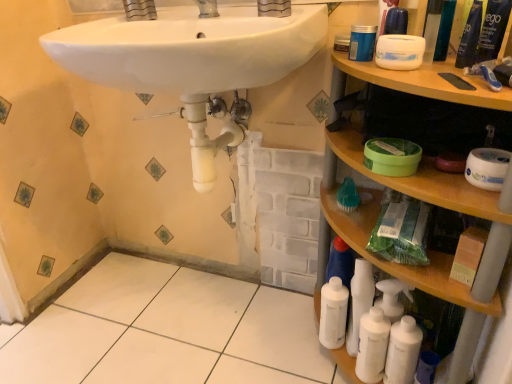
This screenshot has width=512, height=384. Find the location of `matte silver faucet at upper center`. matte silver faucet at upper center is located at coordinates (274, 8).

Describe the element at coordinates (403, 351) in the screenshot. The image size is (512, 384). I see `white glossy mouthwash at lower right, the fourth mouthwash when ordered from right to left` at that location.

The width and height of the screenshot is (512, 384). In order to click on blue plastic container at upper right, the 2th mouthwash positioned from the bottom in this screenshot , I will do pyautogui.click(x=362, y=43).

Describe the element at coordinates (362, 43) in the screenshot. I see `blue plastic container at upper right, the 2th mouthwash positioned from the bottom` at that location.

I want to click on matte silver faucet at upper center, so click(274, 8).

Does white matte toilet paper at right, which appears as the 1th toilet paper when viewed from the right, turn towards white tile floor at lower left?

No, white matte toilet paper at right, which appears as the 1th toilet paper when viewed from the right, does not turn towards white tile floor at lower left.

From a real-world perspective, does white matte toilet paper at right, marked as the 2th toilet paper in a left-to-right arrangement, stand above white tile floor at lower left?

Yes, from a real-world perspective, white matte toilet paper at right, marked as the 2th toilet paper in a left-to-right arrangement, is on top of white tile floor at lower left.

Consider the image. Considering the relative positions of white matte toilet paper at right, which appears as the 1th toilet paper when viewed from the right, and white tile floor at lower left in the image provided, is white matte toilet paper at right, which appears as the 1th toilet paper when viewed from the right, in front of white tile floor at lower left?

Yes, white matte toilet paper at right, which appears as the 1th toilet paper when viewed from the right, is in front of white tile floor at lower left.

Is blue glossy mouthwash at upper right, marked as the 1th mouthwash in a right-to-left arrangement, outside of white matte toothpaste at upper right?

blue glossy mouthwash at upper right, marked as the 1th mouthwash in a right-to-left arrangement, lies outside white matte toothpaste at upper right's area.

Are blue glossy mouthwash at upper right, which is counted as the third mouthwash, starting from the bottom, and white matte toothpaste at upper right beside each other?

blue glossy mouthwash at upper right, which is counted as the third mouthwash, starting from the bottom, and white matte toothpaste at upper right are not in contact.

Can you tell me how much blue glossy mouthwash at upper right, the 3th mouthwash viewed from the top, and white matte toothpaste at upper right differ in facing direction?

38.2 degrees.

Which of these two, blue glossy mouthwash at upper right, which is counted as the third mouthwash, starting from the bottom, or white matte toothpaste at upper right, stands taller?

With more height is blue glossy mouthwash at upper right, which is counted as the third mouthwash, starting from the bottom.

What's the angular difference between white matte toothpaste at upper right and white glossy sink at upper center's facing directions?

The angle between the facing direction of white matte toothpaste at upper right and the facing direction of white glossy sink at upper center is 91.6 degrees.

From a real-world perspective, does white matte toothpaste at upper right stand above white glossy sink at upper center?

Incorrect, from a real-world perspective, white matte toothpaste at upper right is lower than white glossy sink at upper center.

Which of these two, white matte toothpaste at upper right or white glossy sink at upper center, is smaller?

white matte toothpaste at upper right.

Would you say white matte toothpaste at upper right is inside or outside white glossy sink at upper center?

white matte toothpaste at upper right is not inside white glossy sink at upper center, it's outside.

From the image's perspective, which is below, blue plastic container at upper right, which ranks as the 5th mouthwash in right-to-left order, or blue glossy tube at upper right, which is counted as the 2th cleaning product, starting from the bottom?

From the image's view, blue glossy tube at upper right, which is counted as the 2th cleaning product, starting from the bottom, is below.

Which is behind, blue plastic container at upper right, the 2th mouthwash positioned from the bottom, or blue glossy tube at upper right, which is counted as the 2th cleaning product, starting from the back?

blue plastic container at upper right, the 2th mouthwash positioned from the bottom, is behind.

Which of these two, blue plastic container at upper right, which appears as the 4th mouthwash when viewed from the top, or blue glossy tube at upper right, marked as the 1th cleaning product in a top-to-bottom arrangement, is wider?

blue plastic container at upper right, which appears as the 4th mouthwash when viewed from the top, is wider.

Can you tell me how much blue plastic mouthwash at upper right, which ranks as the third mouthwash in left-to-right order, and white glossy sink at upper center differ in facing direction?

blue plastic mouthwash at upper right, which ranks as the third mouthwash in left-to-right order, and white glossy sink at upper center are facing 0.553 degrees away from each other.

Which is in front, blue plastic mouthwash at upper right, which appears as the fourth mouthwash when ordered from the bottom, or white glossy sink at upper center?

white glossy sink at upper center is in front.

Measure the distance from blue plastic mouthwash at upper right, which is the 2th mouthwash in top-to-bottom order, to white glossy sink at upper center.

blue plastic mouthwash at upper right, which is the 2th mouthwash in top-to-bottom order, and white glossy sink at upper center are 17.54 inches apart from each other.

This screenshot has height=384, width=512. There is a white glossy sink at upper center. What are the coordinates of `the 3rd mouthwash above it (from the image's perspective)` in the screenshot? It's located at (432, 28).

Which object is wider, white glossy mouthwash at lower right, positioned as the first mouthwash in bottom-to-top order, or blue glossy tube at upper right, which is counted as the 2th cleaning product, starting from the bottom?

white glossy mouthwash at lower right, positioned as the first mouthwash in bottom-to-top order, is wider.

Considering the positions of points (410, 320) and (472, 43), is point (410, 320) closer to camera compared to point (472, 43)?

No, it is not.

Is white glossy mouthwash at lower right, positioned as the first mouthwash in bottom-to-top order, located outside blue glossy tube at upper right, the first cleaning product viewed from the right?

That's correct, white glossy mouthwash at lower right, positioned as the first mouthwash in bottom-to-top order, is outside of blue glossy tube at upper right, the first cleaning product viewed from the right.

From the image's perspective, is white glossy tap at upper center under blue glossy tube at upper right, the 2th cleaning product positioned from the left?

No.

Between point (211, 4) and point (477, 15), which one is positioned behind?

The point (211, 4) is more distant.

Is white glossy tap at upper center taller than blue glossy tube at upper right, which is the first cleaning product from front to back?

No.

In the scene shown: Considering the sizes of objects white glossy tap at upper center and blue glossy tube at upper right, which is counted as the 2th cleaning product, starting from the bottom, in the image provided, who is bigger, white glossy tap at upper center or blue glossy tube at upper right, which is counted as the 2th cleaning product, starting from the bottom,?

white glossy tap at upper center.

Find the location of a particular element. Image resolution: width=512 pixels, height=384 pixels. the 2nd toilet paper counting from the right of the white tile floor at lower left is located at coordinates (487, 168).

This screenshot has height=384, width=512. Find the location of `the 3rd mouthwash positioned above the white matte toothpaste at upper right (from a real-world perspective)`. the 3rd mouthwash positioned above the white matte toothpaste at upper right (from a real-world perspective) is located at coordinates (493, 29).

Which object lies nearer to the anchor point white plastic bottles at lower right, the first cleaning product from the back, white matte toothpaste at upper right or white glossy sink at upper center?

white matte toothpaste at upper right lies closer to white plastic bottles at lower right, the first cleaning product from the back, than the other object.

Looking at the image, which one is located further to white plastic bottle at lower right, green plastic mouthwash at upper right, the fourth mouthwash viewed from the left, or white glossy sink at upper center?

Based on the image, green plastic mouthwash at upper right, the fourth mouthwash viewed from the left, appears to be further to white plastic bottle at lower right.

Which object lies nearer to the anchor point matte silver faucet at upper center, white matte toilet paper at right, marked as the 2th toilet paper in a left-to-right arrangement, or white glossy mouthwash at lower right, which is counted as the 2th mouthwash, starting from the left?

white matte toilet paper at right, marked as the 2th toilet paper in a left-to-right arrangement.

When comparing their distances from blue glossy mouthwash at upper right, the fifth mouthwash in the left-to-right sequence, does white matte toilet paper at right, marked as the 2th toilet paper in a left-to-right arrangement, or white glossy tap at upper center seem closer?

white matte toilet paper at right, marked as the 2th toilet paper in a left-to-right arrangement, is positioned closer to the anchor blue glossy mouthwash at upper right, the fifth mouthwash in the left-to-right sequence.

From the image, which object appears to be nearer to white glossy sink at upper center, blue plastic mouthwash at upper right, which ranks as the third mouthwash in left-to-right order, or white plastic bottle at lower right?

blue plastic mouthwash at upper right, which ranks as the third mouthwash in left-to-right order, is positioned closer to the anchor white glossy sink at upper center.

Looking at the image, which one is located further to white matte container at upper right, the 1th toilet paper positioned from the left, white glossy sink at upper center or blue glossy mouthwash at upper right, marked as the 1th mouthwash in a right-to-left arrangement?

white glossy sink at upper center is positioned further to the anchor white matte container at upper right, the 1th toilet paper positioned from the left.

From the image, which object appears to be nearer to white glossy mouthwash at lower right, the 5th mouthwash when ordered from top to bottom, white tile floor at lower left or white matte toilet paper at right, the second toilet paper positioned from the top?

white matte toilet paper at right, the second toilet paper positioned from the top.

Which object lies further to the anchor point wooden cabinet at right, white glossy tap at upper center or white tile floor at lower left?

white glossy tap at upper center is positioned further to the anchor wooden cabinet at right.

You are a GUI agent. You are given a task and a screenshot of the screen. Output one action in this format:
    pyautogui.click(x=<x>, y=<y>)
    Task: Click on the cabinet located between white glossy sink at upper center and white matte toothpaste at upper right in the left-right direction
    
    Given the screenshot: What is the action you would take?
    click(424, 200)

Image resolution: width=512 pixels, height=384 pixels. What are the coordinates of `cleaning product between blue glossy mouthwash at upper right, marked as the 1th mouthwash in a right-to-left arrangement, and wooden cabinet at right vertically` in the screenshot? It's located at (470, 37).

At what (x,y) coordinates should I click in order to perform the action: click on cabinet between white matte container at upper right, the 2th toilet paper ordered from the bottom, and white tile floor at lower left vertically. Please return your answer as a coordinate pair (x, y). Looking at the image, I should click on (424, 200).

The height and width of the screenshot is (384, 512). What are the coordinates of `sink between blue plastic container at upper right, which ranks as the 5th mouthwash in right-to-left order, and white tile floor at lower left in the up-down direction` in the screenshot? It's located at coord(192,62).